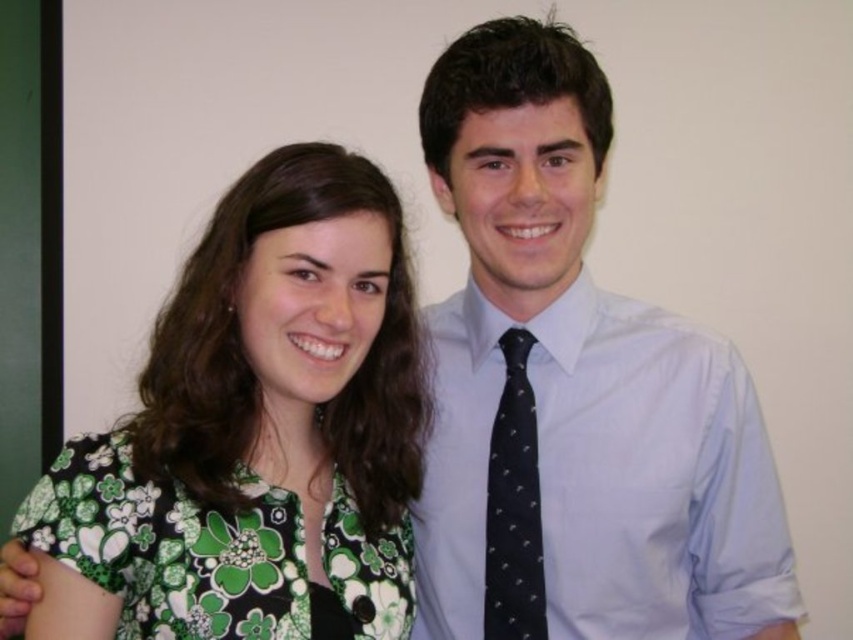
Consider the image. You are taking a photo of two people standing against a wall. You notice the green floral shirt at left and the dark tie with white polka dots on the right. Based on their positions, which clothing item is closer to the center of the image?

The green floral shirt at left is located at point (277, 408), which is closer to the center of the image compared to the dark tie with white polka dots on the right.

You are a photographer adjusting the camera focus. You need to ensure both the light blue shirt and tie at center and the green floral fabric dress at lower left are in focus. Which object is closer to the camera, and therefore requires adjusting the focus to that distance first?

The light blue shirt and tie at center is closer to the camera than the green floral fabric dress at lower left. Therefore, you should first adjust the focus to the distance of the light blue shirt and tie at center to ensure both are in focus.

You are a photographer trying to adjust the focus of your camera. You notice two points in the image at coordinates point (x=514, y=184) and point (x=209, y=544). Which point is closer to the camera lens?

Point (x=514, y=184) is closer to the camera lens because it is further to the viewer than point (x=209, y=544).